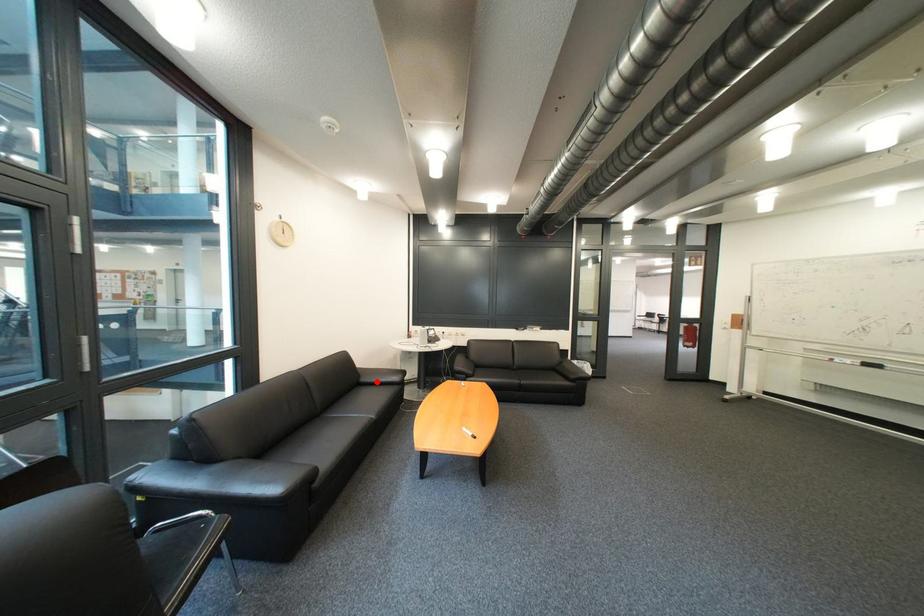
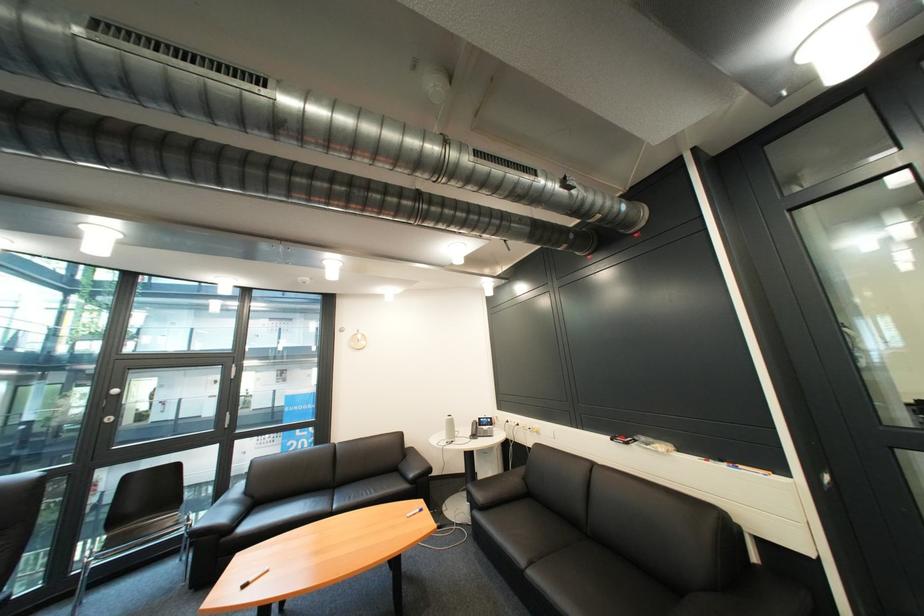
Question: I am providing you with two images of the same scene from different viewpoints. Given a red point in image1, look at the same physical point in image2. Is it:

Choices:
 (A) Closer to the viewpoint
 (B) Farther from the viewpoint

Answer: (B)